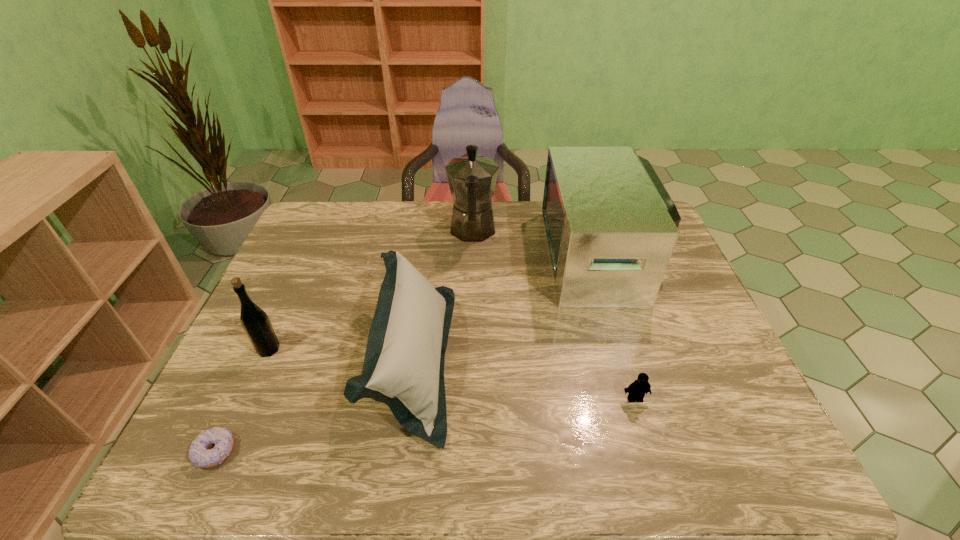
The width and height of the screenshot is (960, 540). I want to click on free spot located 0.060m on the front-facing side of the microwave oven, so click(x=530, y=255).

Locate an element on the screen. vacant space located on the right of the beer bottle is located at coordinates (376, 349).

Locate an element on the screen. free space located on the surface of the fourth tallest object is located at coordinates (587, 360).

The height and width of the screenshot is (540, 960). In order to click on vacant region located 0.090m on the face of the Lego in this screenshot , I will do coord(647,441).

This screenshot has height=540, width=960. I want to click on free space located on the back of the doughnut, so click(280, 310).

At what (x,y) coordinates should I click in order to perform the action: click on coffeepot located in the far edge section of the desktop. Please return your answer as a coordinate pair (x, y). This screenshot has height=540, width=960. Looking at the image, I should click on (472, 177).

At what (x,y) coordinates should I click in order to perform the action: click on microwave oven present at the far edge. Please return your answer as a coordinate pair (x, y). Image resolution: width=960 pixels, height=540 pixels. Looking at the image, I should click on (611, 227).

At what (x,y) coordinates should I click in order to perform the action: click on cushion at the near edge. Please return your answer as a coordinate pair (x, y). Looking at the image, I should click on point(403,367).

Locate an element on the screen. doughnut located in the near edge section of the desktop is located at coordinates (198, 454).

Image resolution: width=960 pixels, height=540 pixels. I want to click on beer bottle that is at the left edge, so click(x=255, y=322).